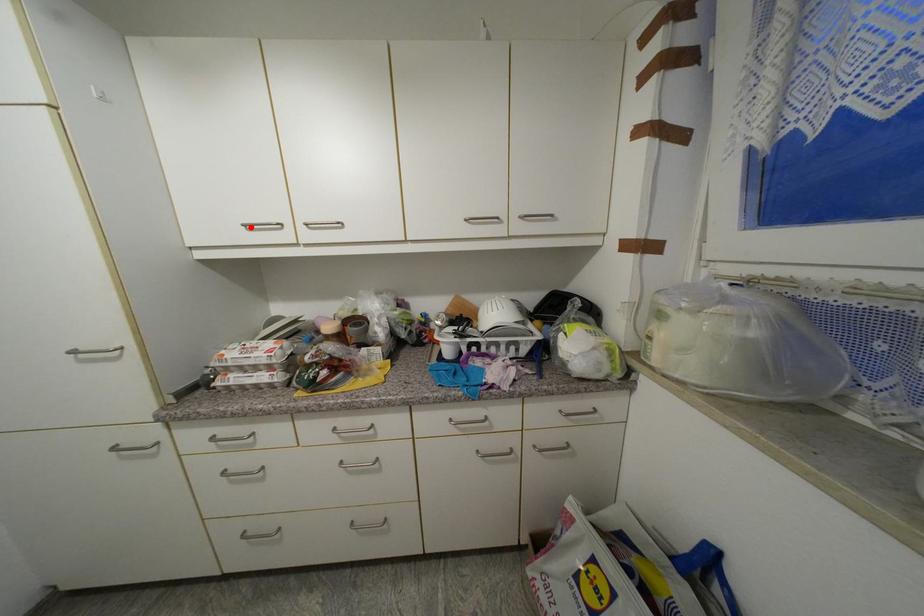
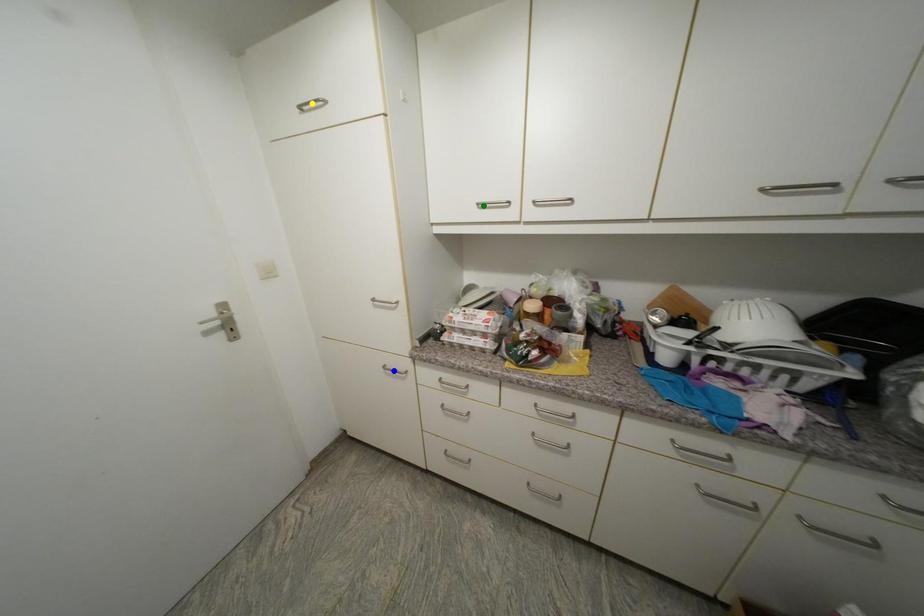
Question: I am providing you with two images of the same scene from different viewpoints. A red point is marked on the first image. You are given multiple points on the second image. Which point in image 2 is actually the same real-world point as the red point in image 1?

Choices:
 (A) green point
 (B) blue point
 (C) yellow point

Answer: (A)